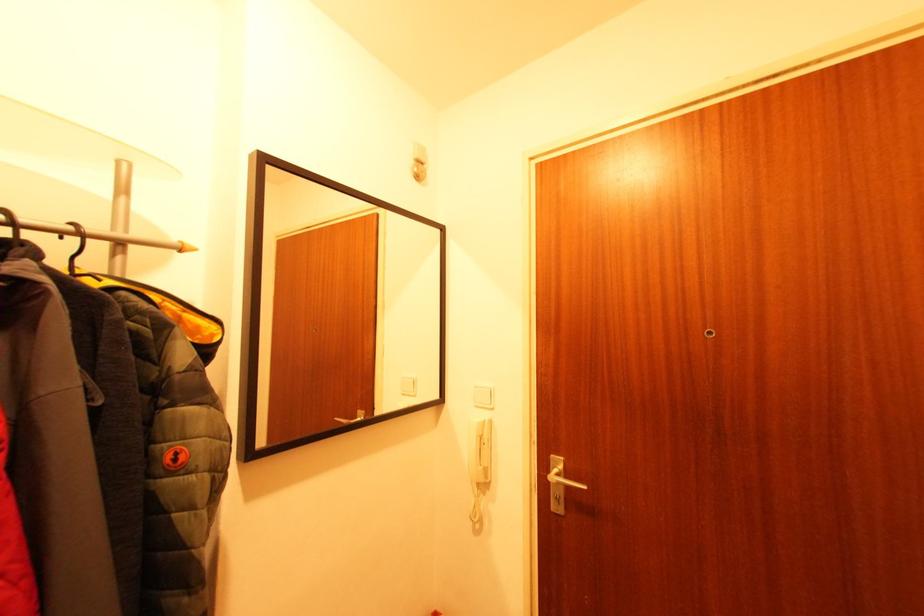
What do you see at coordinates (482, 395) in the screenshot? I see `the white wall switch` at bounding box center [482, 395].